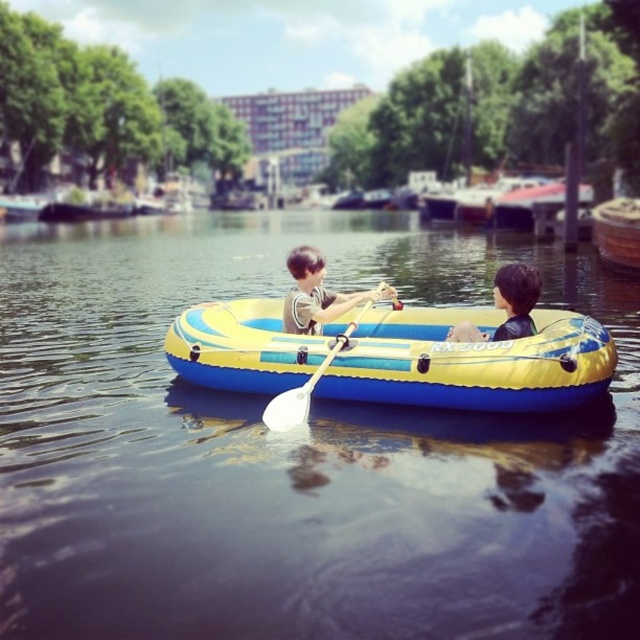
You are a photographer trying to capture the blue rubber boat at center and the white plastic paddle at center in a single shot. To ensure both are visible, should you adjust your camera to focus more to the left or the right?

You should focus more to the left because the blue rubber boat at center is positioned to the left of the white plastic paddle at center, so adjusting the camera to the left will help capture both objects in the frame.

You are a photographer trying to capture a closeup shot of the two people in the boat. You notice the matte black shirt at center and the smooth brown hair at center. Which object should you focus on if you want to ensure the narrower subject is in sharp focus?

The matte black shirt at center has a lesser width compared to the smooth brown hair at center, so you should focus on the matte black shirt at center to ensure the narrower subject is in sharp focus.

What are the coordinates of the blue rubber boat at center?

The blue rubber boat at center is located at point (294, 451).